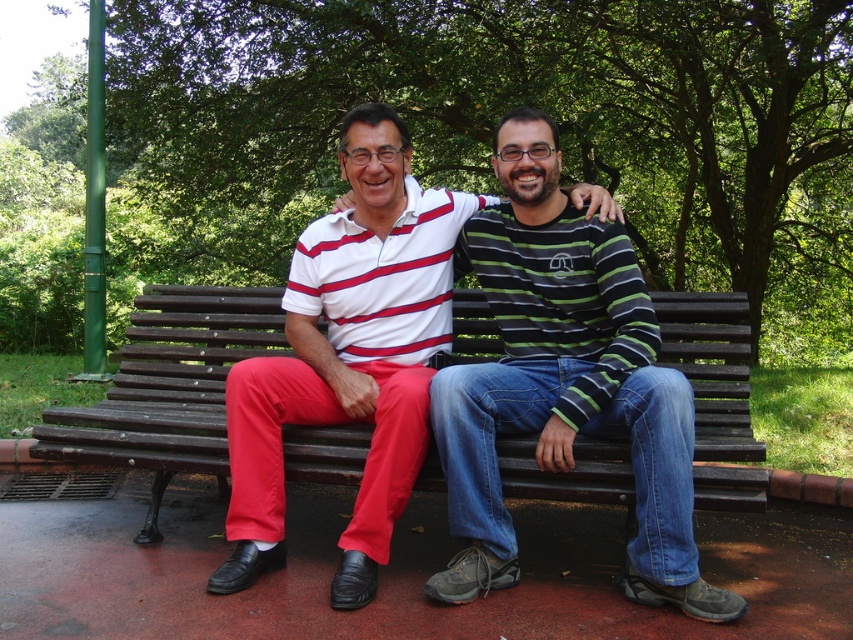
You are a photographer setting up a shot of the striped cotton shirt at center and the wooden bench at center. To ensure the shirt is in focus while the bench is slightly blurred, where should you adjust the camera focus? Please mention both objects in your answer.

You should focus on the striped cotton shirt at center since it is above the wooden bench at center, allowing the bench to be slightly out of focus while keeping the shirt sharp.

You are a photographer setting up a shot of two people sitting on a bench. You need to ensure that both the striped cotton shirt at center and the white striped polo shirt at center are fully visible in the frame. Based on their positions, which shirt might require you to adjust the camera angle to capture it properly?

The striped cotton shirt at center might be wider than the white striped polo shirt at center, so you might need to adjust the camera angle to ensure the entire striped cotton shirt at center is visible in the frame.

You are trying to determine if the striped cotton shirt at center can fit into a bag designed to hold items no larger than the wooden bench at center. Based on the scene, will the shirt fit?

The striped cotton shirt at center has a larger size compared to wooden bench at center, so it will not fit into the bag designed for items no larger than the wooden bench at center.